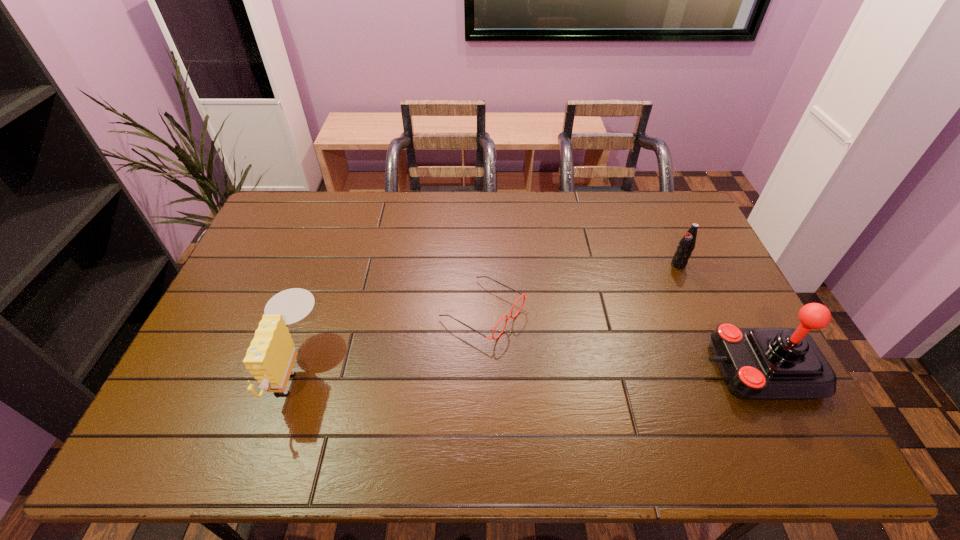
Locate an element on the screen. The image size is (960, 540). free region located 0.130m on the base of the joystick is located at coordinates (655, 368).

You are a GUI agent. You are given a task and a screenshot of the screen. Output one action in this format:
    pyautogui.click(x=<x>, y=<y>)
    Task: Click on the vacant space located on the base of the joystick
    
    Given the screenshot: What is the action you would take?
    pyautogui.click(x=556, y=368)

You are a GUI agent. You are given a task and a screenshot of the screen. Output one action in this format:
    pyautogui.click(x=<x>, y=<y>)
    Task: Click on the free region located on the base of the joystick
    The width and height of the screenshot is (960, 540).
    Given the screenshot: What is the action you would take?
    pyautogui.click(x=556, y=368)

The height and width of the screenshot is (540, 960). What are the coordinates of `vacant space situated 0.140m on the front-facing side of the shortest object` in the screenshot? It's located at (564, 356).

Locate an element on the screen. The image size is (960, 540). vacant space located 0.170m on the front-facing side of the shortest object is located at coordinates (574, 361).

This screenshot has width=960, height=540. I want to click on vacant space situated 0.220m on the front-facing side of the shortest object, so 591,371.

This screenshot has width=960, height=540. Identify the location of free space located on the front label of the pop. (652, 279).

At what (x,y) coordinates should I click in order to perform the action: click on blank area located on the front label of the pop. Please return your answer as a coordinate pair (x, y). This screenshot has height=540, width=960. Looking at the image, I should click on point(588,316).

Where is `vacant space located 0.090m on the front label of the pop`? vacant space located 0.090m on the front label of the pop is located at coordinates (655, 278).

Image resolution: width=960 pixels, height=540 pixels. In order to click on sponge located in the near edge section of the desktop in this screenshot , I will do `click(270, 358)`.